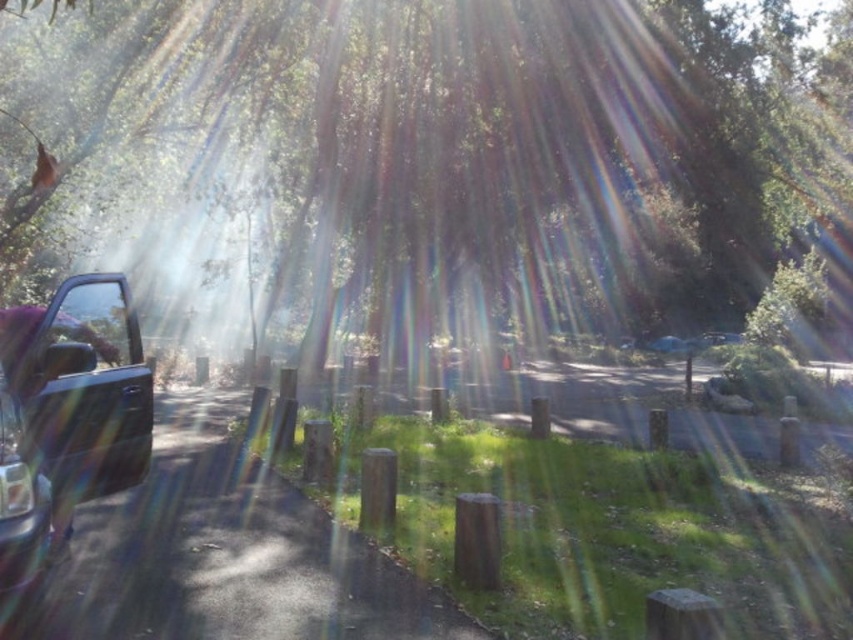
Who is taller, shiny metallic truck at left or clear glass window at left?

Standing taller between the two is shiny metallic truck at left.

Does shiny metallic truck at left come in front of clear glass window at left?

Yes.

Find the location of a particular element. Image resolution: width=853 pixels, height=640 pixels. shiny metallic truck at left is located at coordinates (67, 413).

What do you see at coordinates (426, 163) in the screenshot? I see `green leafy tree at left` at bounding box center [426, 163].

Is green leafy tree at left to the right of clear glass window at left from the viewer's perspective?

Correct, you'll find green leafy tree at left to the right of clear glass window at left.

Does point (206, 260) come behind point (88, 294)?

Yes, it is.

Image resolution: width=853 pixels, height=640 pixels. In order to click on green leafy tree at left in this screenshot , I will do (x=426, y=163).

Is green leafy tree at left further to camera compared to shiny metallic truck at left?

That is True.

Is green leafy tree at left below shiny metallic truck at left?

Actually, green leafy tree at left is above shiny metallic truck at left.

Is point (585, 248) closer to camera compared to point (134, 454)?

No, it is behind (134, 454).

The width and height of the screenshot is (853, 640). Find the location of `green leafy tree at left`. green leafy tree at left is located at coordinates (426, 163).